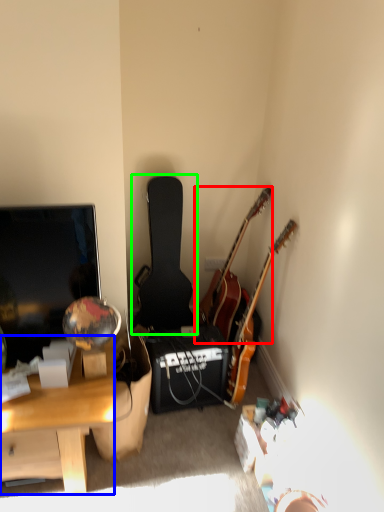
Question: Considering the real-world distances, which object is farthest from guitar (highlighted by a red box)? desk (highlighted by a blue box) or guitar (highlighted by a green box)?

Choices:
 (A) desk
 (B) guitar

Answer: (A)